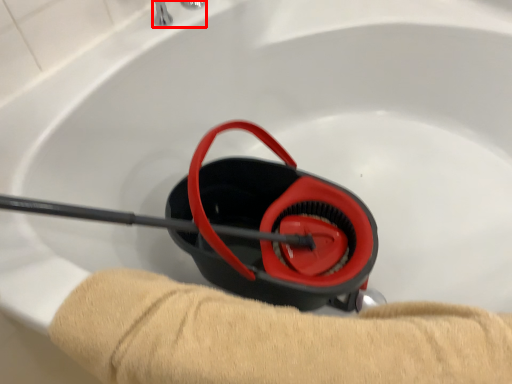
Question: From the image's perspective, where is faucet (annotated by the red box) located in relation to tan in the image?

Choices:
 (A) below
 (B) above

Answer: (B)